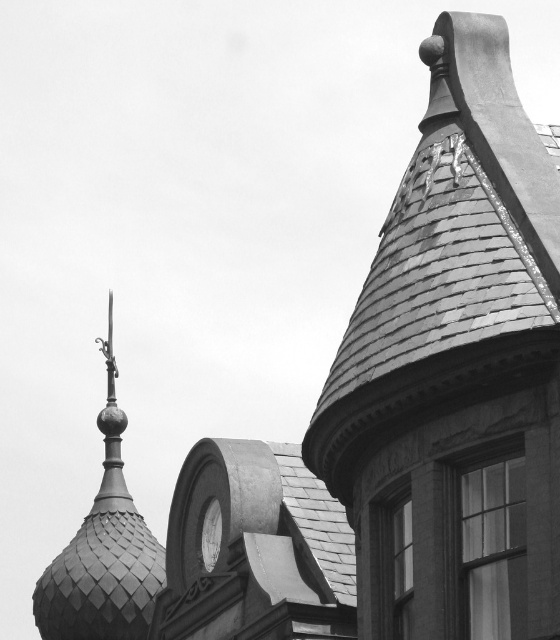
Who is positioned more to the left, polished metal spire at upper left or white glossy clock at center?

Positioned to the left is polished metal spire at upper left.

Is polished metal spire at upper left thinner than white glossy clock at center?

Incorrect, polished metal spire at upper left's width is not less than white glossy clock at center's.

Does point (150, 608) come farther from viewer compared to point (211, 509)?

Yes, point (150, 608) is behind point (211, 509).

Locate an element on the screen. polished metal spire at upper left is located at coordinates (104, 548).

Looking at this image, is shiny gray slate roof at upper right below polished metal spire at upper left?

Correct, shiny gray slate roof at upper right is located below polished metal spire at upper left.

Locate an element on the screen. The image size is (560, 640). shiny gray slate roof at upper right is located at coordinates (454, 369).

Identify the location of shiny gray slate roof at upper right. (454, 369).

Does shiny gray slate roof at upper right have a lesser width compared to white glossy clock at center?

No.

From the picture: Is the position of shiny gray slate roof at upper right more distant than that of white glossy clock at center?

No, shiny gray slate roof at upper right is closer to the viewer.

Who is more distant from viewer, (x=465, y=310) or (x=217, y=509)?

The point (x=217, y=509) is behind.

Locate an element on the screen. This screenshot has width=560, height=640. shiny gray slate roof at upper right is located at coordinates (454, 369).